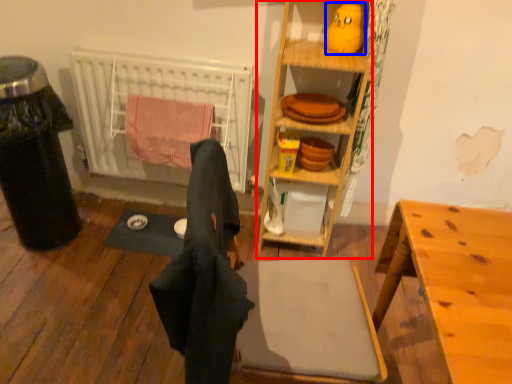
Question: Among these objects, which one is farthest to the camera, cabinetry (highlighted by a red box) or toy (highlighted by a blue box)?

Choices:
 (A) cabinetry
 (B) toy

Answer: (B)